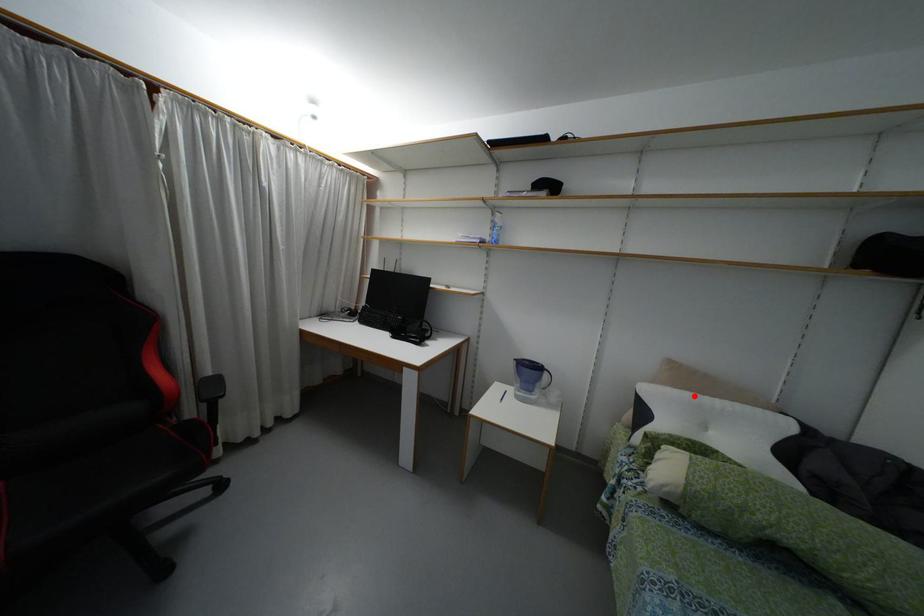
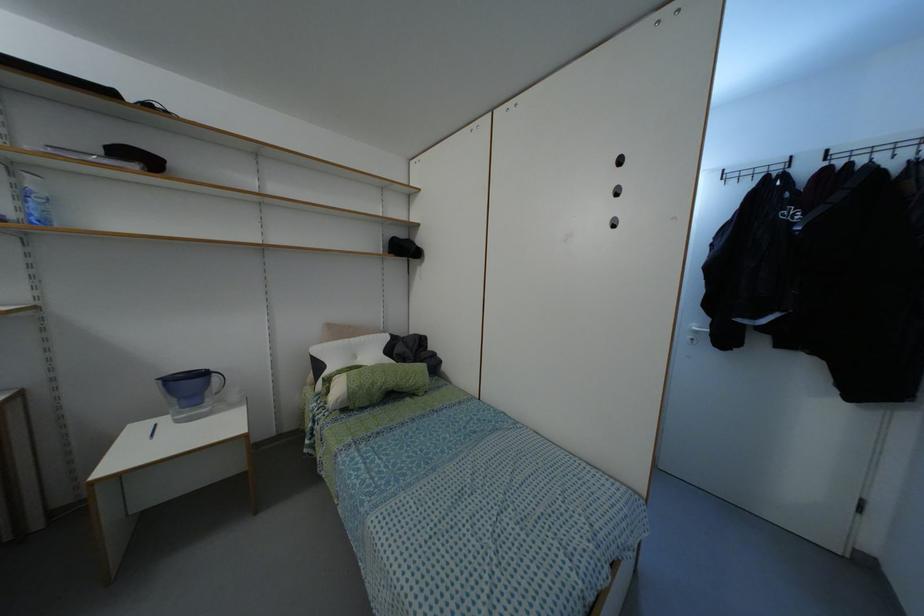
Where in the second image is the point corresponding to the highlighted location from the first image?

(345, 339)